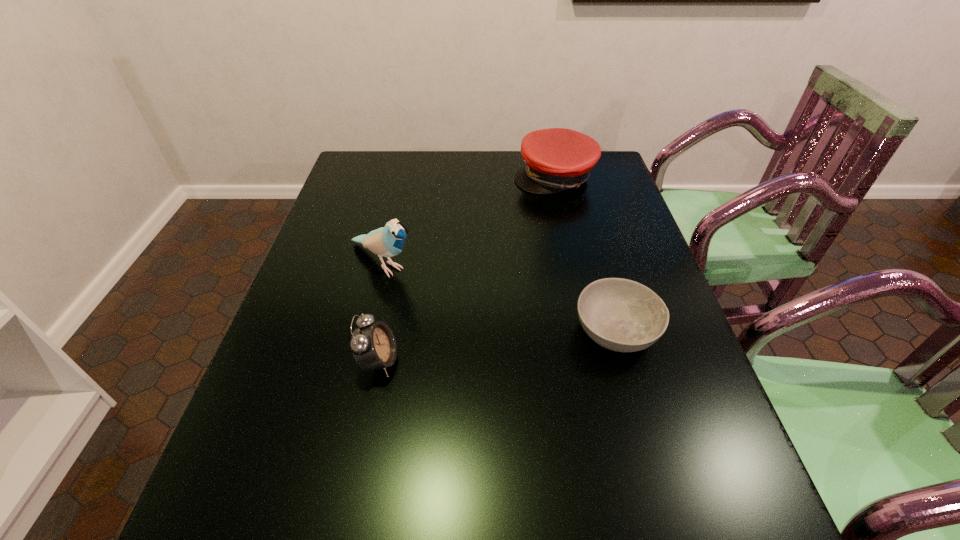
I want to click on free spot on the desktop that is between the alarm clock and the shortest object and is positioned on the front-facing side of the cap, so pos(474,349).

Identify the location of vacant space on the desktop that is between the alarm clock and the bowl and is positioned at the face of the bird. This screenshot has width=960, height=540. (496, 346).